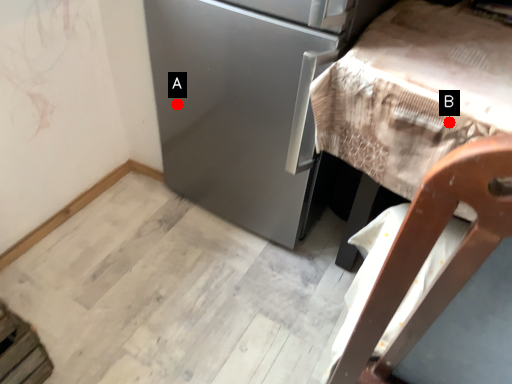
Question: Two points are circled on the image, labeled by A and B beside each circle. Which point appears closest to the camera in this image?

Choices:
 (A) A is closer
 (B) B is closer

Answer: (B)